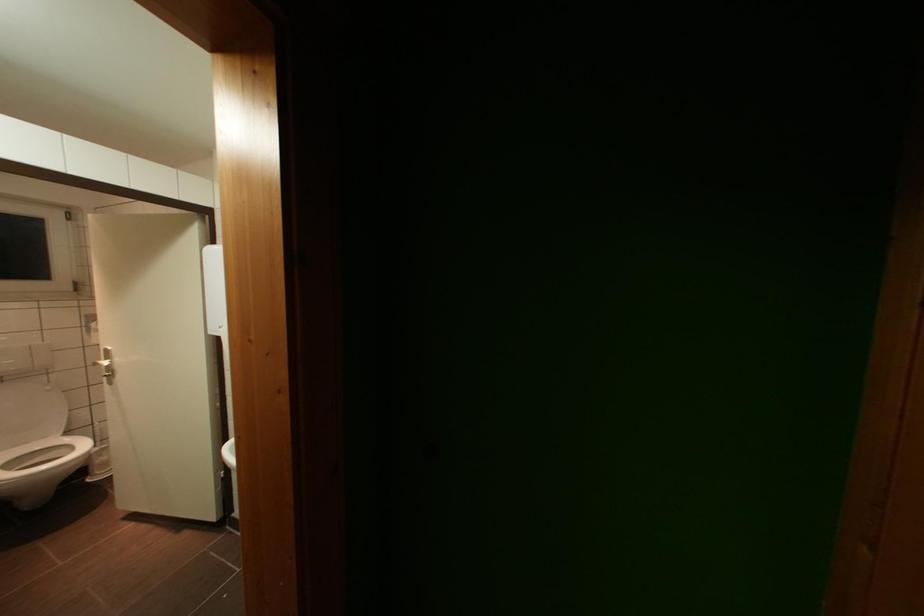
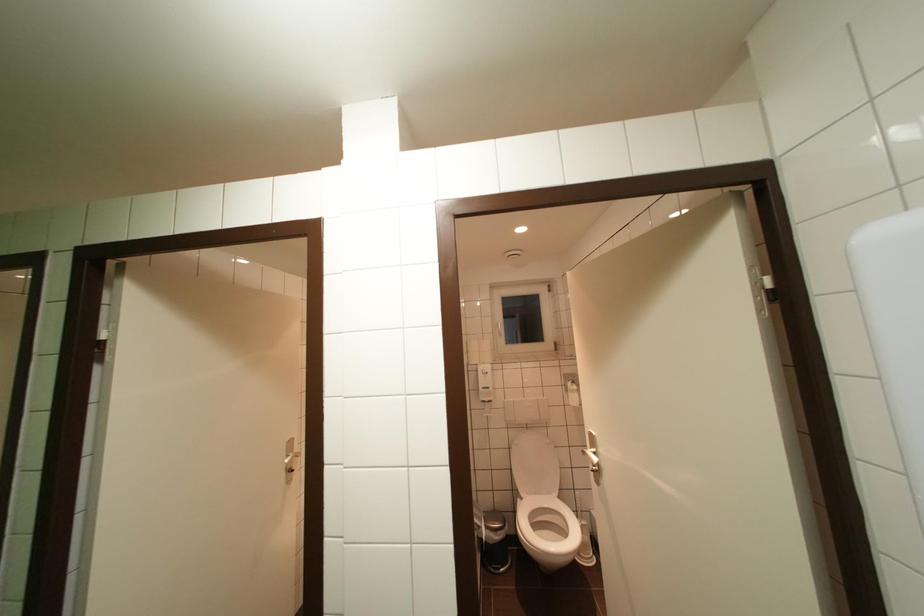
Locate, in the second image, the point that corresponds to point 103,368 in the first image.

(591, 456)